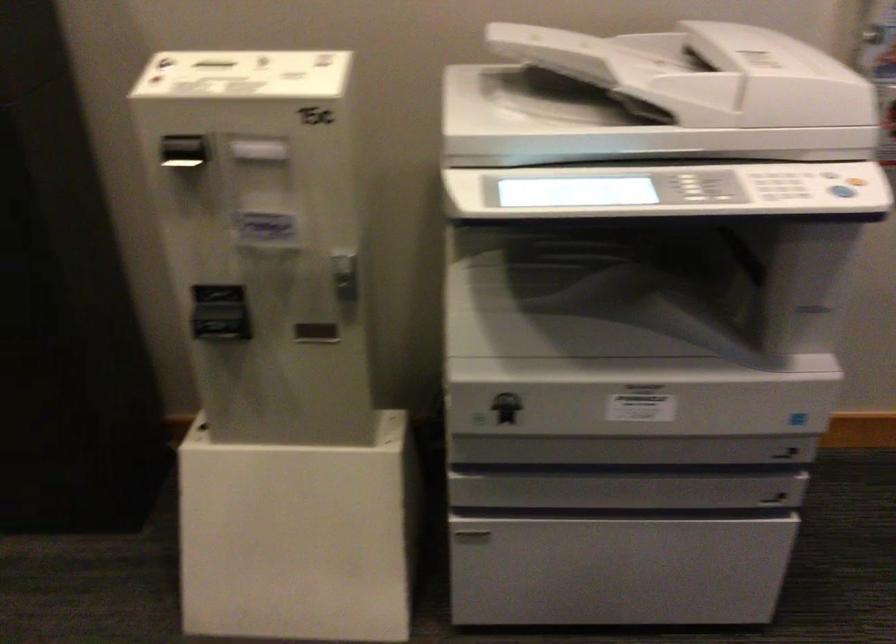
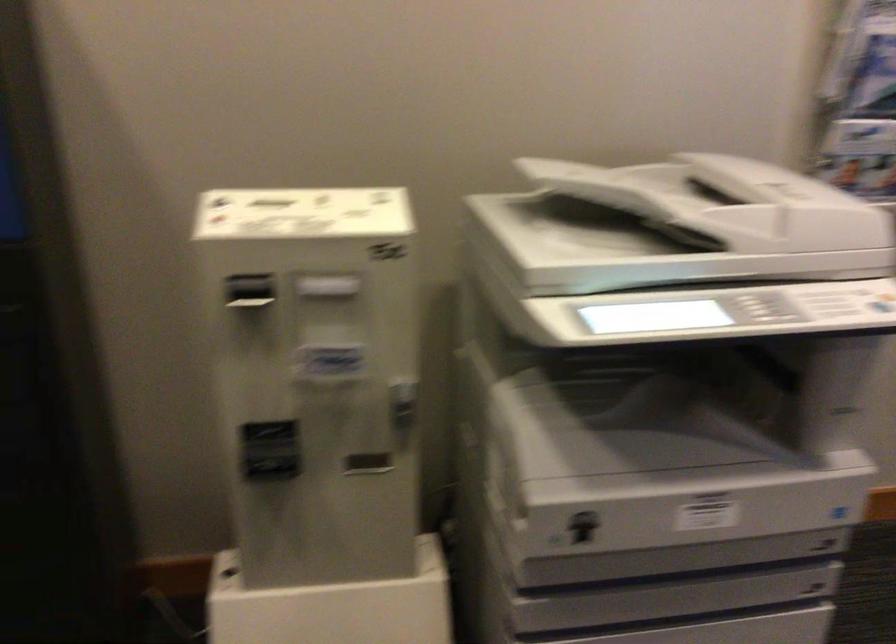
In the second image, find the point that corresponds to (x=182, y=154) in the first image.

(250, 292)